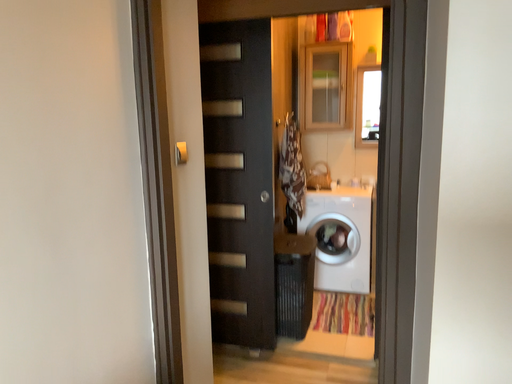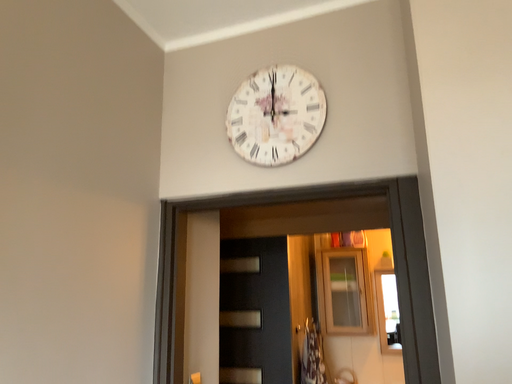
Question: Which way did the camera rotate in the video?

Choices:
 (A) rotated upward
 (B) rotated downward

Answer: (A)